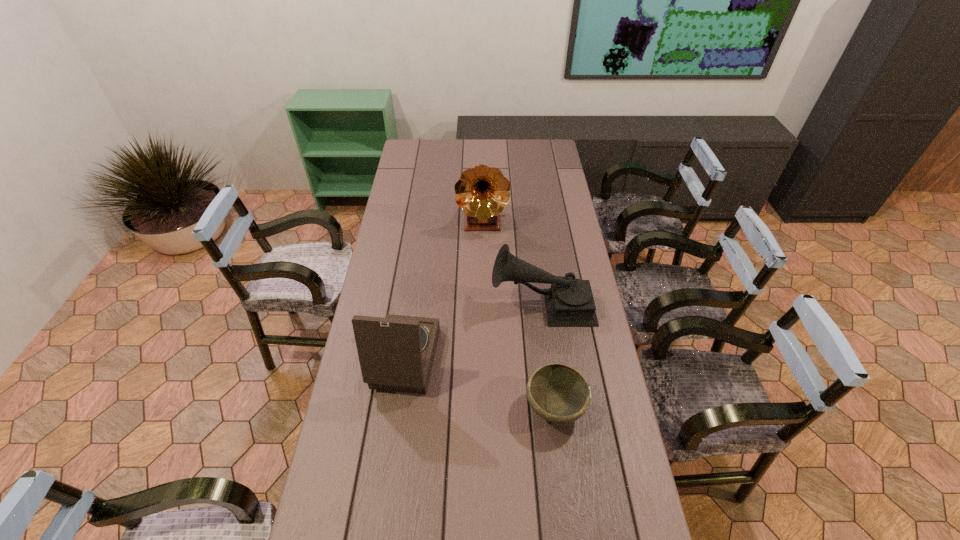
I want to click on vacant space that satisfies the following two spatial constraints: 1. on the horn of the bowl; 2. on the left side of the farthest phonograph_record, so click(484, 408).

Identify the location of free location that satisfies the following two spatial constraints: 1. on the front side of the leftmost phonograph_record; 2. on the left side of the shortest object. The width and height of the screenshot is (960, 540). (390, 408).